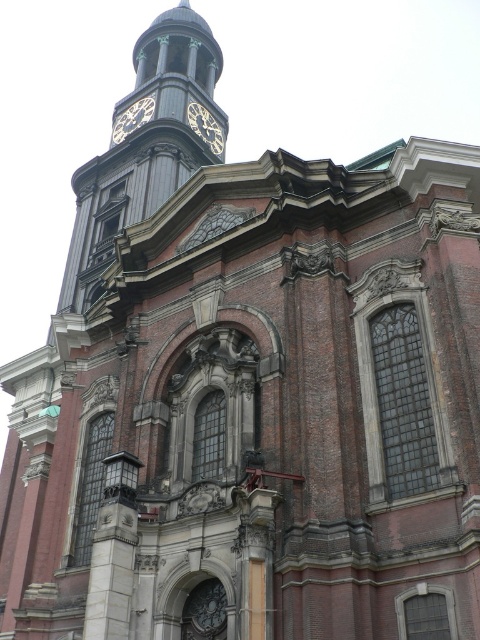
You are standing in front of the cathedral and want to check the time on both the gold metallic clock at upper left and the gold metallic clock at upper center. Which clock is positioned higher up on the tower?

The gold metallic clock at upper left is located above the gold metallic clock at upper center, so it is positioned higher up on the tower.

You are an architect analyzing the symmetry of the building. Based on the placement of the polished brass clock tower at upper center and the gold metallic clock at upper left, which one is located more to the left side of the building?

The polished brass clock tower at upper center is positioned on the left side of gold metallic clock at upper left, meaning it is more to the left side of the building.